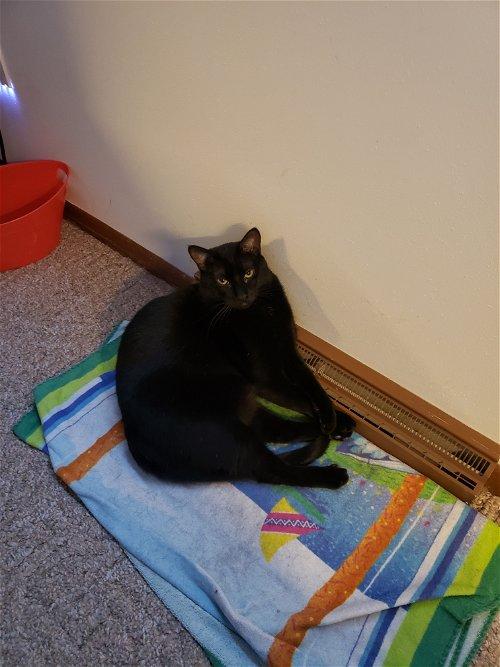
I want to click on floor, so click(x=40, y=596).